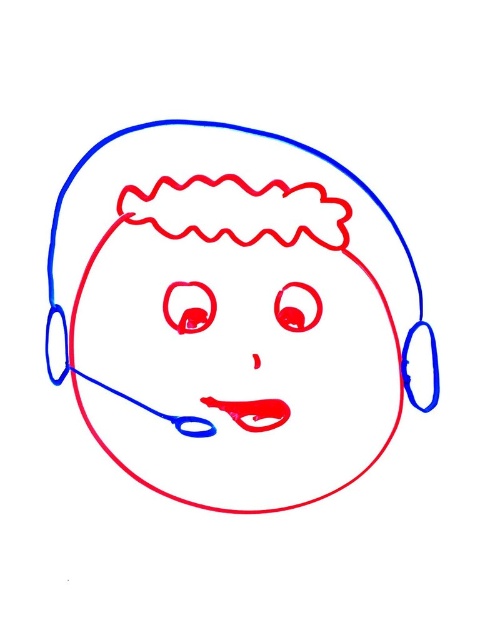
Question: Which point appears farthest from the camera in this image?

Choices:
 (A) (59, 198)
 (B) (266, 403)

Answer: (B)

Question: Considering the relative positions of matte blue headset at center and rubber-like red mouth at center in the image provided, where is matte blue headset at center located with respect to rubber-like red mouth at center?

Choices:
 (A) right
 (B) left

Answer: (B)

Question: Is matte blue headset at center above rubber-like red mouth at center?

Choices:
 (A) yes
 (B) no

Answer: (A)

Question: Does matte blue headset at center appear on the left side of rubber-like red mouth at center?

Choices:
 (A) no
 (B) yes

Answer: (B)

Question: Which object appears farthest from the camera in this image?

Choices:
 (A) matte blue headset at center
 (B) rubber-like red mouth at center

Answer: (B)

Question: Which point appears farthest from the camera in this image?

Choices:
 (A) (219, 179)
 (B) (272, 397)

Answer: (B)